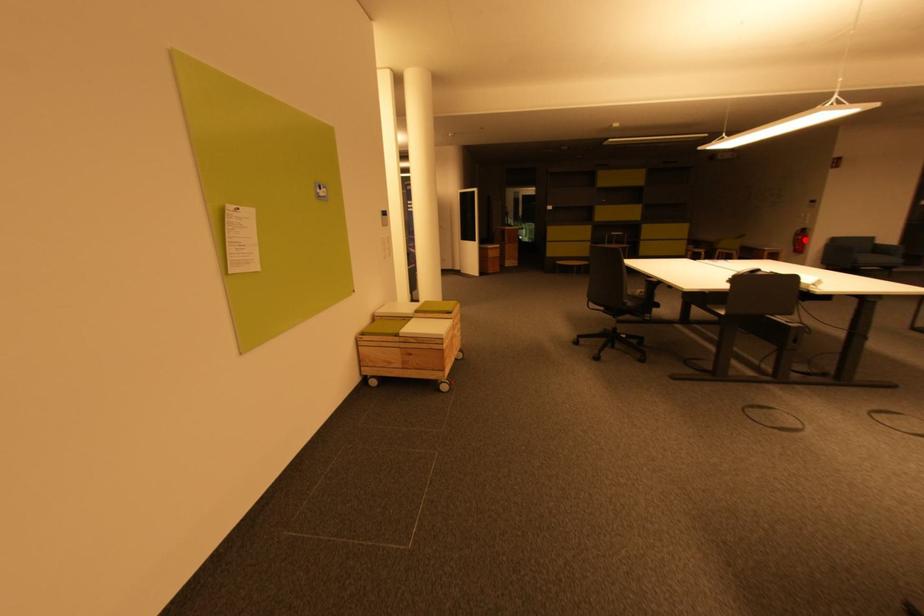
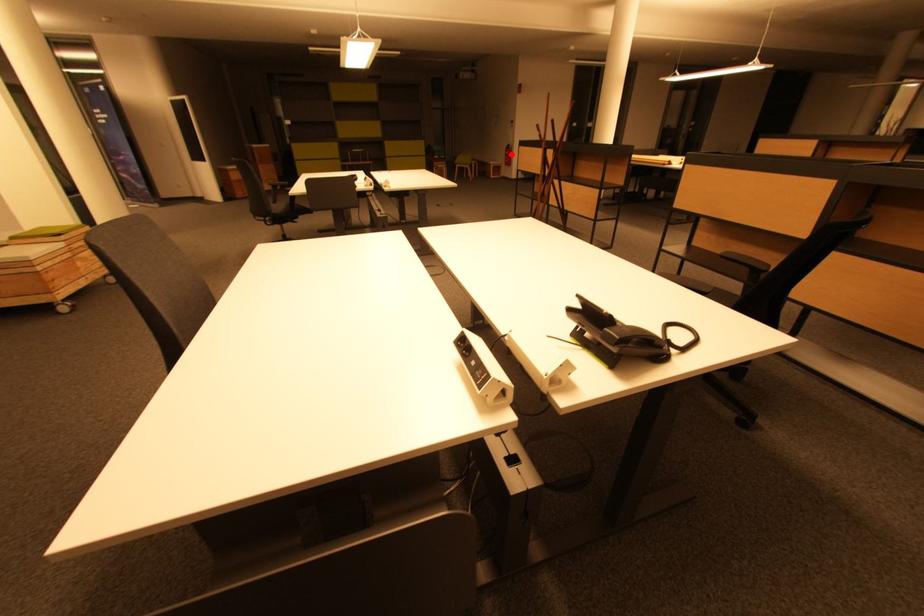
I am providing you with two images of the same scene from different viewpoints. A red point is marked on the first image and another point is marked on the second image. Are the points marked in image1 and image2 representing the same 3D position?

Yes